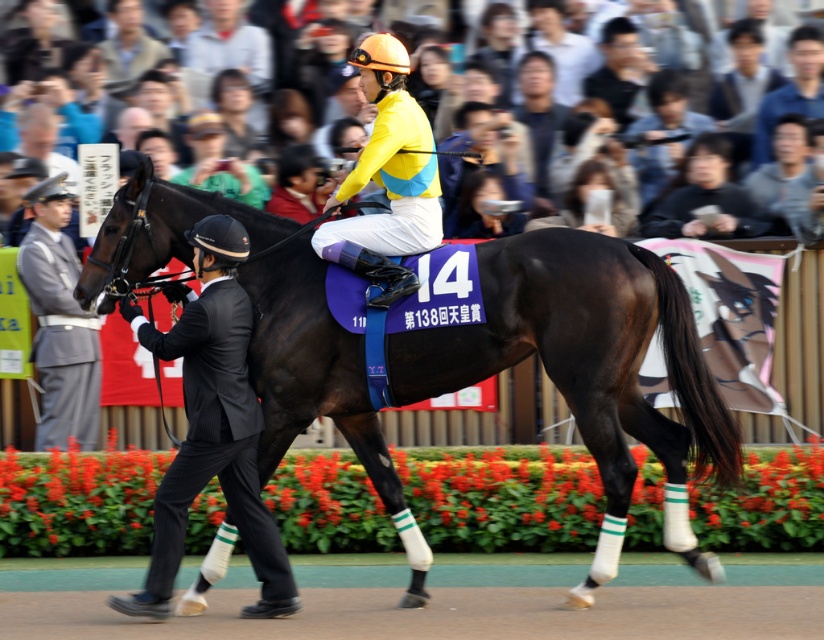
You are a photographer at the horse racing event. You need to capture a photo that includes both the dirt track at center and the gray uniform at left. Which object should be placed closer to the camera to ensure both fit in the frame?

The dirt track at center is smaller in size compared to the gray uniform at left. To ensure both fit in the frame, the dirt track at center should be placed closer to the camera since it is smaller and needs to be magnified to balance its size with the larger gray uniform at left in the photo.